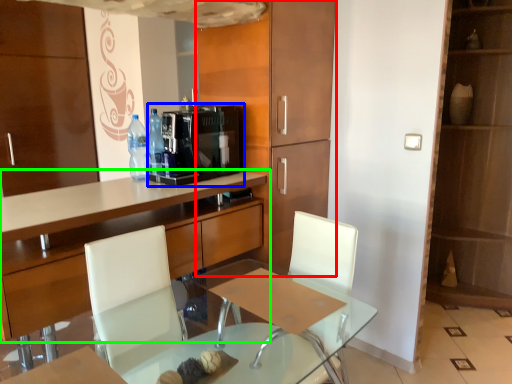
Question: Estimate the real-world distances between objects in this image. Which object is closer to cabinetry (highlighted by a red box), coffee machine (highlighted by a blue box) or cabinetry (highlighted by a green box)?

Choices:
 (A) coffee machine
 (B) cabinetry

Answer: (A)